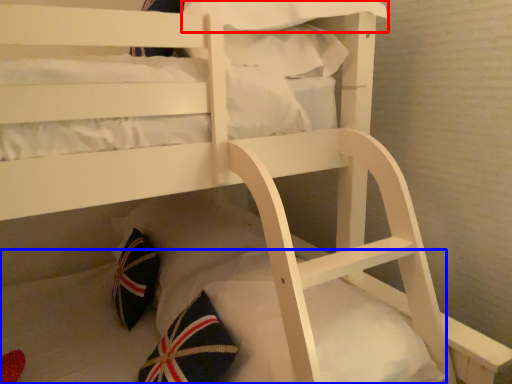
Question: Which object appears farthest to the camera in this image, pillow (highlighted by a red box) or mattress (highlighted by a blue box)?

Choices:
 (A) pillow
 (B) mattress

Answer: (A)